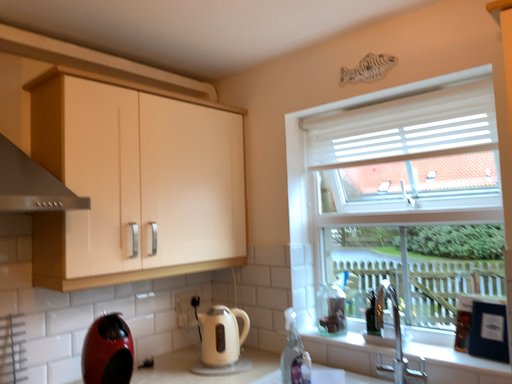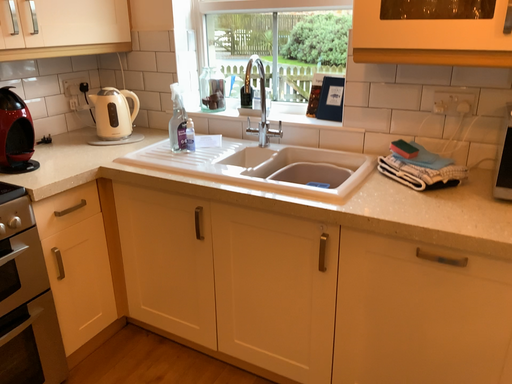
Question: Which way did the camera rotate in the video?

Choices:
 (A) rotated left
 (B) rotated right

Answer: (B)